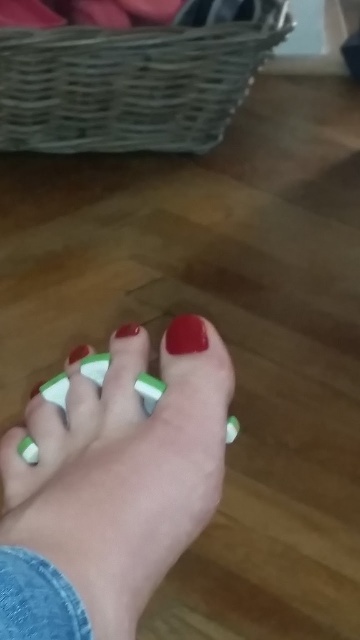
Question: Based on their relative distances, which object is farther from the green matte nail at center?

Choices:
 (A) glossy red nail at center
 (B) woven wicker basket at upper left
 (C) green matte nail at lower left
 (D) green matte nail polish at center

Answer: (B)

Question: Does glossy red nail at center come behind green matte nail at lower left?

Choices:
 (A) no
 (B) yes

Answer: (A)

Question: Which object is closer to the camera taking this photo?

Choices:
 (A) woven wicker basket at upper left
 (B) green matte nail polish at center
 (C) green matte nail at lower left

Answer: (B)

Question: Can you confirm if green matte nail polish at center is positioned to the left of green matte nail at center?

Choices:
 (A) yes
 (B) no

Answer: (A)

Question: Is green matte nail polish at center wider than green matte nail at lower left?

Choices:
 (A) no
 (B) yes

Answer: (B)

Question: Which point is closer to the camera?

Choices:
 (A) green matte nail at lower left
 (B) green matte nail polish at center
 (C) glossy red nail at center

Answer: (B)